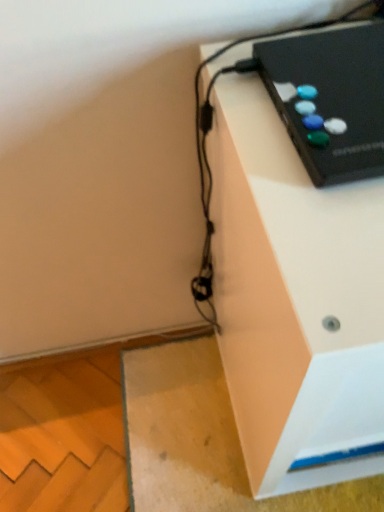
This screenshot has height=512, width=384. What do you see at coordinates (333, 97) in the screenshot?
I see `black plastic gamepad at upper right` at bounding box center [333, 97].

Locate an element on the screen. This screenshot has width=384, height=512. black plastic gamepad at upper right is located at coordinates (333, 97).

The image size is (384, 512). What do you see at coordinates (294, 298) in the screenshot?
I see `black plastic remote control at upper right` at bounding box center [294, 298].

Measure the distance between point (328, 368) and camera.

A distance of 12.05 inches exists between point (328, 368) and camera.

At what (x,y) coordinates should I click in order to perform the action: click on black plastic remote control at upper right. Please return your answer as a coordinate pair (x, y). The image size is (384, 512). Looking at the image, I should click on (294, 298).

In order to face black plastic remote control at upper right, should I rotate leftwards or rightwards?

Rotate right and turn 22.067 degrees.

In order to click on black plastic gamepad at upper right in this screenshot , I will do `click(333, 97)`.

Considering the relative positions of black plastic gamepad at upper right and black plastic remote control at upper right in the image provided, is black plastic gamepad at upper right to the left or to the right of black plastic remote control at upper right?

From the image, it's evident that black plastic gamepad at upper right is to the left of black plastic remote control at upper right.

Which object is more forward, black plastic gamepad at upper right or black plastic remote control at upper right?

Positioned in front is black plastic remote control at upper right.

Is point (357, 105) more distant than point (266, 161)?

Yes.

Based on the photo, from the image's perspective, is black plastic gamepad at upper right located above or below black plastic remote control at upper right?

black plastic gamepad at upper right is above black plastic remote control at upper right.

From a real-world perspective, is black plastic gamepad at upper right on top of black plastic remote control at upper right?

Yes, from a real-world perspective, black plastic gamepad at upper right is on top of black plastic remote control at upper right.

In terms of width, does black plastic gamepad at upper right look wider or thinner when compared to black plastic remote control at upper right?

black plastic gamepad at upper right is thinner than black plastic remote control at upper right.

Who is shorter, black plastic gamepad at upper right or black plastic remote control at upper right?

black plastic gamepad at upper right is shorter.

Based on their sizes in the image, would you say black plastic gamepad at upper right is bigger or smaller than black plastic remote control at upper right?

Considering their sizes, black plastic gamepad at upper right takes up less space than black plastic remote control at upper right.

Is black plastic remote control at upper right a part of black plastic gamepad at upper right?

Actually, black plastic remote control at upper right is outside black plastic gamepad at upper right.

Is black plastic gamepad at upper right positioned far away from black plastic remote control at upper right?

That's not correct — black plastic gamepad at upper right is a little close to black plastic remote control at upper right.

Is black plastic gamepad at upper right oriented towards black plastic remote control at upper right?

No, black plastic gamepad at upper right is not aimed at black plastic remote control at upper right.

In the image, there is a black plastic remote control at upper right. At what (x,y) coordinates should I click in order to perform the action: click on computer above it (from the image's perspective). Please return your answer as a coordinate pair (x, y). This screenshot has height=512, width=384. Looking at the image, I should click on (333, 97).

Does black plastic remote control at upper right appear on the left side of black plastic gamepad at upper right?

No.

Is black plastic remote control at upper right in front of or behind black plastic gamepad at upper right in the image?

black plastic remote control at upper right is in front of black plastic gamepad at upper right.

Does point (325, 191) appear closer or farther from the camera than point (309, 71)?

Clearly, point (325, 191) is closer to the camera than point (309, 71).

From the image's perspective, is black plastic remote control at upper right positioned above or below black plastic gamepad at upper right?

Based on their image positions, black plastic remote control at upper right is located beneath black plastic gamepad at upper right.

From a real-world perspective, between black plastic remote control at upper right and black plastic gamepad at upper right, who is vertically higher?

From a 3D spatial view, black plastic gamepad at upper right is above.

Does black plastic remote control at upper right have a lesser width compared to black plastic gamepad at upper right?

Incorrect, the width of black plastic remote control at upper right is not less than that of black plastic gamepad at upper right.

Considering the relative sizes of black plastic remote control at upper right and black plastic gamepad at upper right in the image provided, is black plastic remote control at upper right taller than black plastic gamepad at upper right?

Yes.

Does black plastic remote control at upper right have a larger size compared to black plastic gamepad at upper right?

Indeed, black plastic remote control at upper right has a larger size compared to black plastic gamepad at upper right.

Would you say black plastic remote control at upper right is inside or outside black plastic gamepad at upper right?

black plastic remote control at upper right lies outside black plastic gamepad at upper right.

Consider the image. Is black plastic remote control at upper right far away from black plastic gamepad at upper right?

No, black plastic remote control at upper right is not far away from black plastic gamepad at upper right.

From the picture: Could you tell me if black plastic remote control at upper right is turned towards black plastic gamepad at upper right?

No.

Consider the image. How different are the orientations of black plastic remote control at upper right and black plastic gamepad at upper right in degrees?

There is a 0.000161-degree angle between the facing directions of black plastic remote control at upper right and black plastic gamepad at upper right.

Image resolution: width=384 pixels, height=512 pixels. I want to click on computer on the left of black plastic remote control at upper right, so click(x=333, y=97).

Where is `computer above the black plastic remote control at upper right (from a real-world perspective)`? computer above the black plastic remote control at upper right (from a real-world perspective) is located at coordinates (333, 97).

What are the coordinates of `furniture in front of the black plastic gamepad at upper right` in the screenshot? It's located at (294, 298).